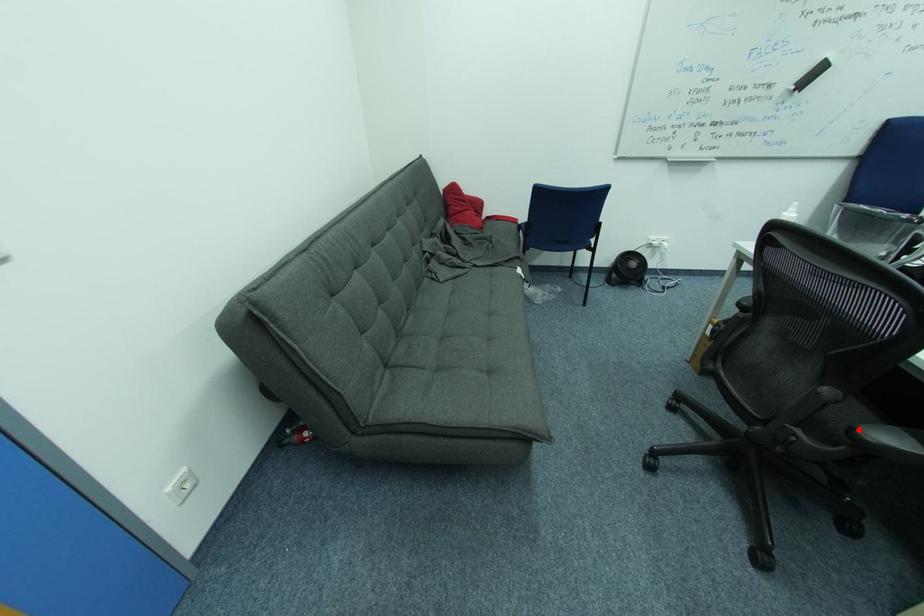
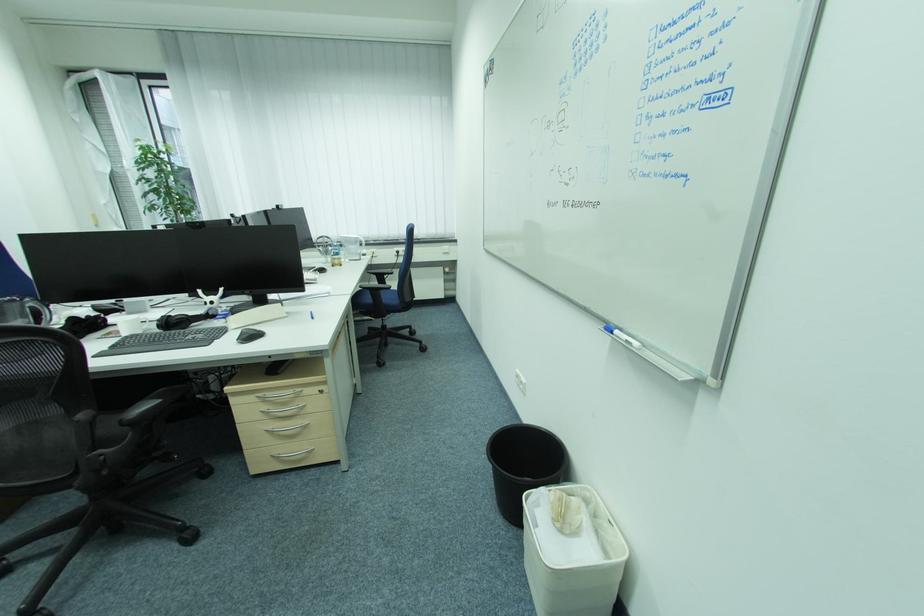
Find the pixel in the second image that matches the highlighted location in the first image.

(128, 422)